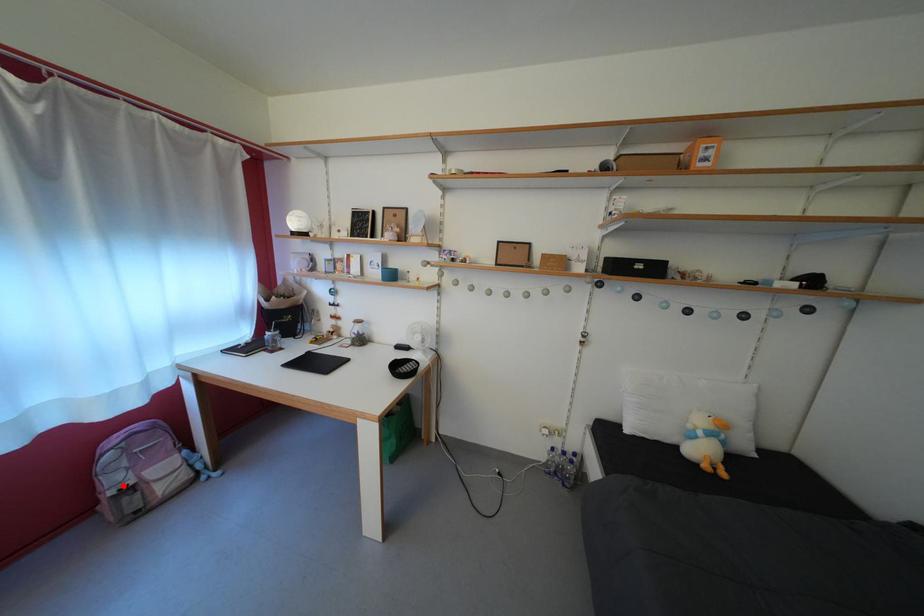
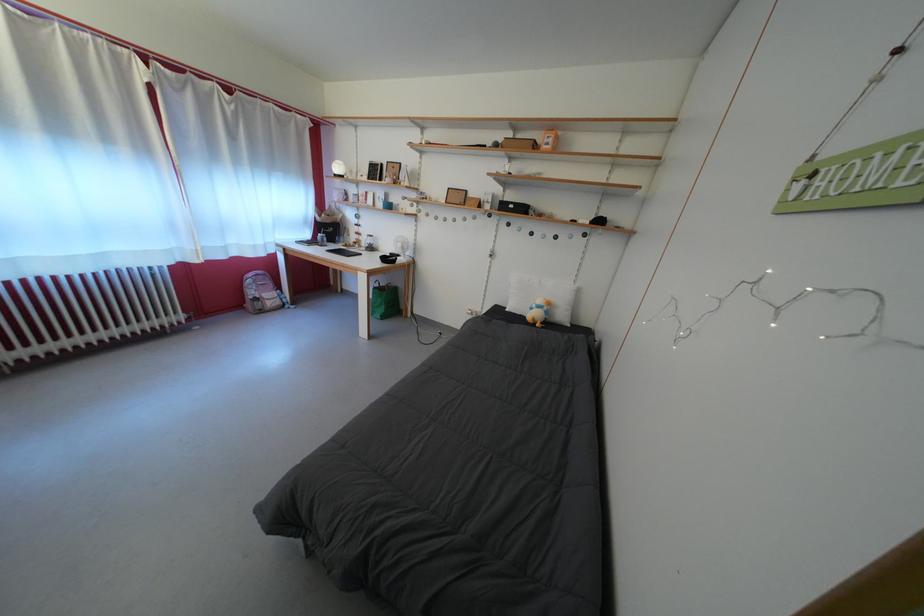
Question: I am providing you with two images of the same scene from different viewpoints. In image1, a red point is highlighted. Considering the same 3D point in image2, which of the following is correct?

Choices:
 (A) It is closer
 (B) It is farther

Answer: (A)